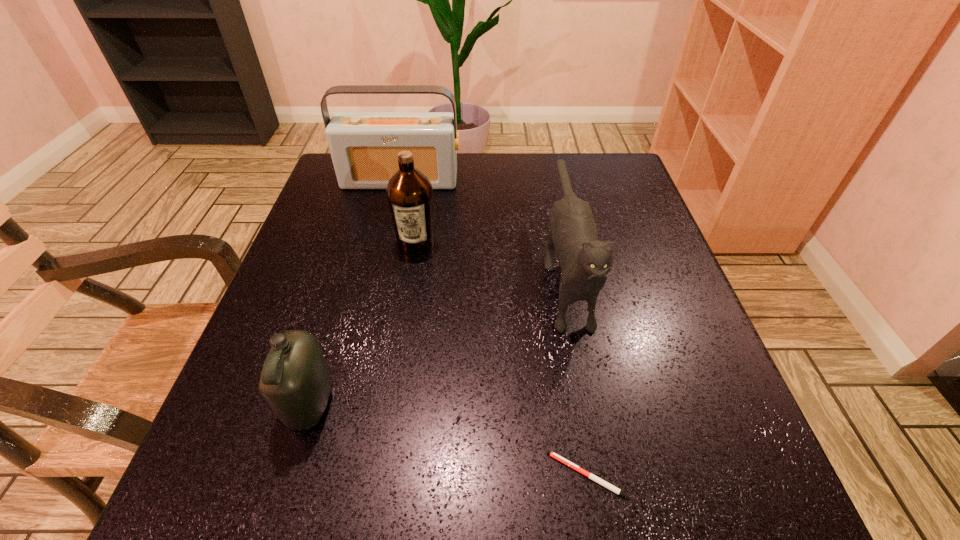
Find the location of `blank area located on the back of the second shortest object`. blank area located on the back of the second shortest object is located at coordinates (326, 350).

The image size is (960, 540). Identify the location of vacant space located on the clicker of the pen. (464, 475).

Find the location of a particular element. The width and height of the screenshot is (960, 540). free space located 0.290m on the clicker of the pen is located at coordinates (344, 475).

You are a GUI agent. You are given a task and a screenshot of the screen. Output one action in this format:
    pyautogui.click(x=<x>, y=<y>)
    Task: Click on the vacant space located 0.180m on the clicker of the pen
    The width and height of the screenshot is (960, 540).
    Given the screenshot: What is the action you would take?
    click(421, 475)

Locate an element on the screen. object that is positioned at the far edge is located at coordinates (364, 146).

What are the coordinates of `object present at the near edge` in the screenshot? It's located at (600, 481).

Locate an element on the screen. This screenshot has height=540, width=960. radio receiver situated at the left edge is located at coordinates (364, 146).

The width and height of the screenshot is (960, 540). I want to click on bottle present at the left edge, so click(295, 381).

Find the location of `object situated at the far left corner`. object situated at the far left corner is located at coordinates (364, 146).

In the image, there is a desktop. Where is `vacant space at the near edge`? vacant space at the near edge is located at coordinates (362, 490).